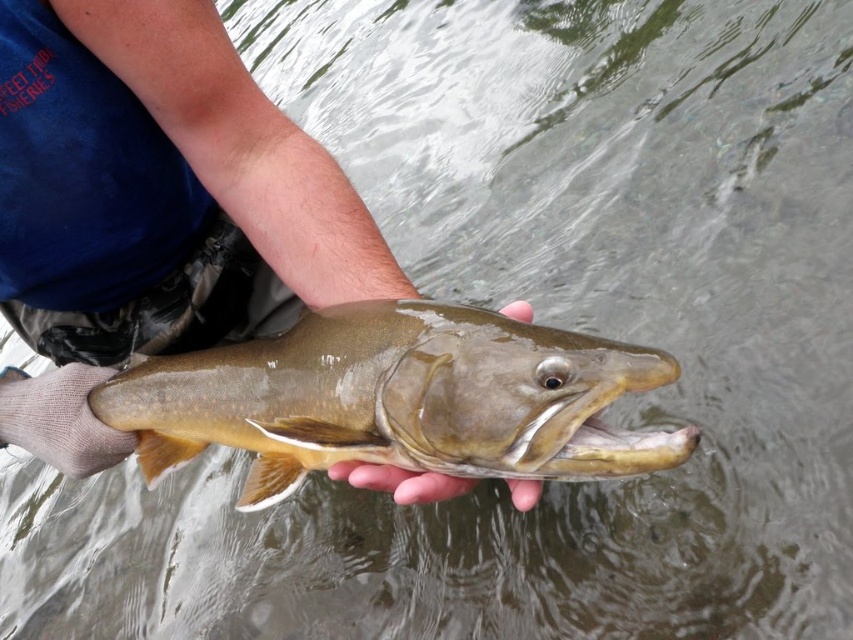
You are a biologist measuring fish for a study. You have a ruler that can measure up to 30 cm. You see the shiny brown fish at center and smooth skin hand at center in the image. Can you use the ruler to measure the fish?

The shiny brown fish at center is wider than the smooth skin hand at center. Since the ruler can measure up to 30 cm and the fish is wider than the hand, it is likely within the ruler length. Yes, you can use the ruler to measure the fish.